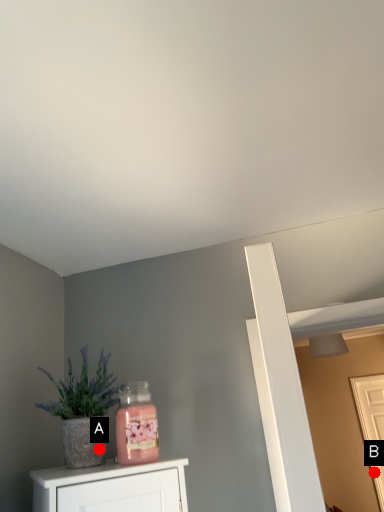
Question: Two points are circled on the image, labeled by A and B beside each circle. Which of the following is the farthest from the observer?

Choices:
 (A) A is further
 (B) B is further

Answer: (B)